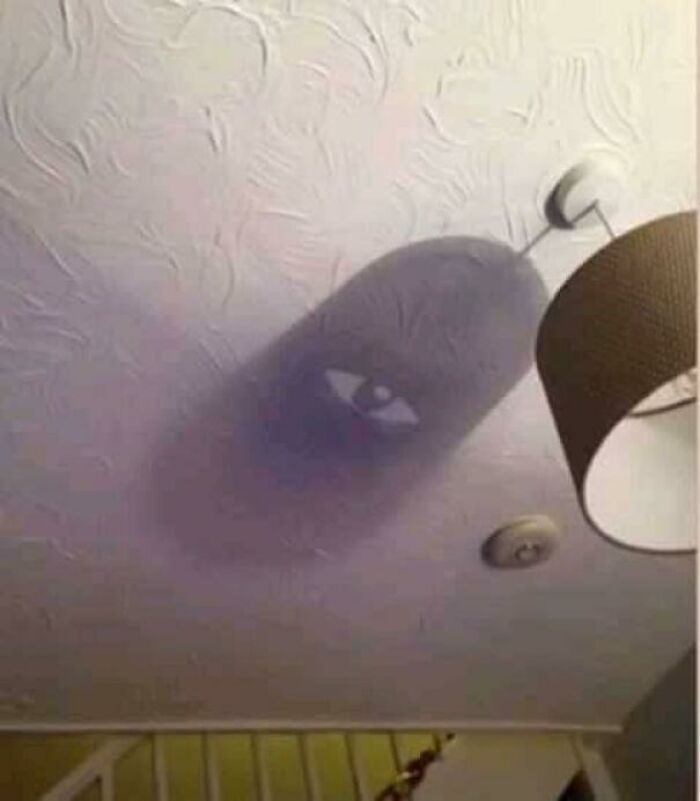
Find the location of `white wall`. white wall is located at coordinates (41, 775), (234, 568).